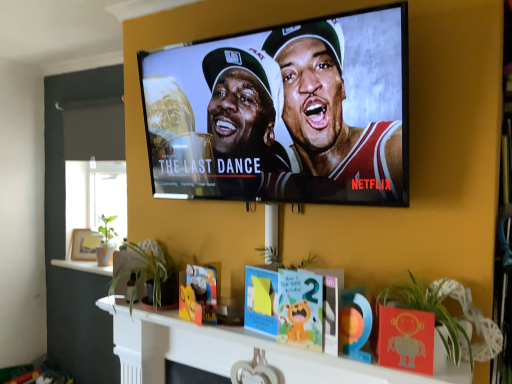
Question: Considering the relative positions of green leafy plant at lower center, which ranks as the first plant in left-to-right order, and green leafy plant at lower right, positioned as the second plant in left-to-right order, in the image provided, is green leafy plant at lower center, which ranks as the first plant in left-to-right order, behind green leafy plant at lower right, positioned as the second plant in left-to-right order,?

Choices:
 (A) no
 (B) yes

Answer: (B)

Question: Is green leafy plant at lower center, which is counted as the 1th plant, starting from the back, outside of green leafy plant at lower right, marked as the second plant in a back-to-front arrangement?

Choices:
 (A) no
 (B) yes

Answer: (B)

Question: From the image's perspective, is green leafy plant at lower center, which appears as the 2th plant when viewed from the front, below green leafy plant at lower right, positioned as the second plant in left-to-right order?

Choices:
 (A) yes
 (B) no

Answer: (B)

Question: Can you confirm if green leafy plant at lower center, which is the 2th plant from right to left, is positioned to the left of green leafy plant at lower right, the first plant positioned from the front?

Choices:
 (A) no
 (B) yes

Answer: (B)

Question: From a real-world perspective, is green leafy plant at lower center, which ranks as the first plant in left-to-right order, positioned over green leafy plant at lower right, marked as the second plant in a back-to-front arrangement, based on gravity?

Choices:
 (A) yes
 (B) no

Answer: (A)

Question: From a real-world perspective, is green leafy plant at lower center, which appears as the 2th plant when viewed from the front, below green leafy plant at lower right, placed as the 1th plant when sorted from right to left?

Choices:
 (A) yes
 (B) no

Answer: (B)

Question: Is wooden photo frame at left at the left side of matte black tv at upper center?

Choices:
 (A) no
 (B) yes

Answer: (B)

Question: From a real-world perspective, is wooden photo frame at left physically below matte black tv at upper center?

Choices:
 (A) no
 (B) yes

Answer: (B)

Question: Does wooden photo frame at left have a greater height compared to matte black tv at upper center?

Choices:
 (A) yes
 (B) no

Answer: (B)

Question: Is wooden photo frame at left looking in the opposite direction of matte black tv at upper center?

Choices:
 (A) no
 (B) yes

Answer: (A)

Question: Is wooden photo frame at left bigger than matte black tv at upper center?

Choices:
 (A) no
 (B) yes

Answer: (A)

Question: Is wooden photo frame at left closer to the viewer compared to matte black tv at upper center?

Choices:
 (A) no
 (B) yes

Answer: (A)

Question: Is matte black tv at upper center positioned before wooden photo frame at left?

Choices:
 (A) no
 (B) yes

Answer: (B)